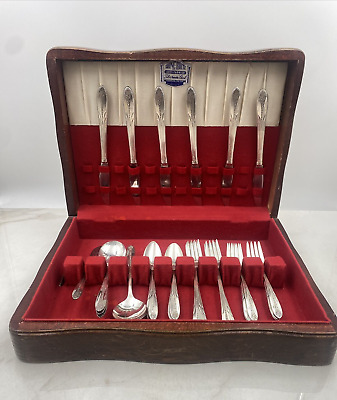
The width and height of the screenshot is (337, 400). I want to click on knives, so click(105, 120), click(128, 117), click(161, 121), click(193, 118), click(231, 119), click(262, 122).